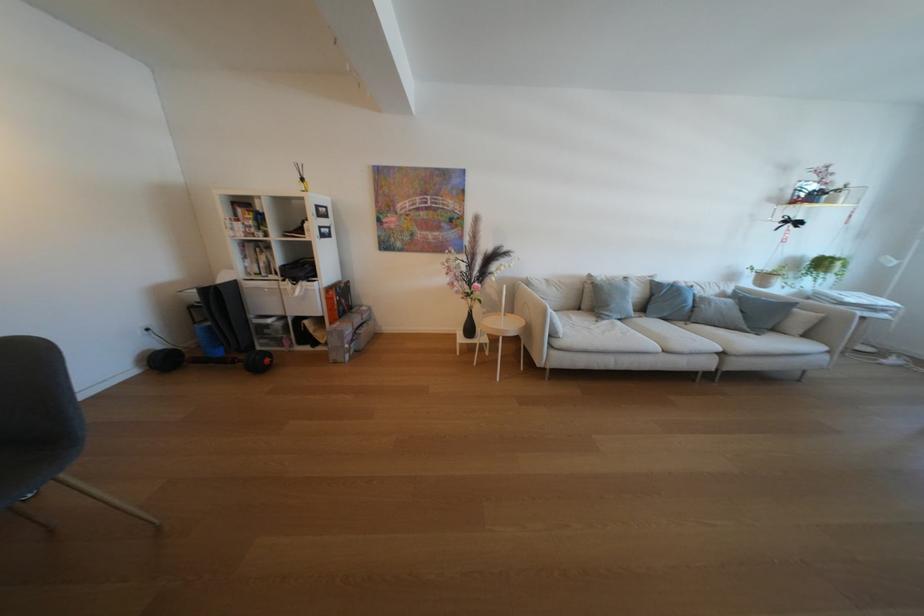
At what (x,y) coordinates should I click in order to perform the action: click on blue foam roller. Please return your answer as a coordinate pair (x, y). The height and width of the screenshot is (616, 924). Looking at the image, I should click on (219, 334).